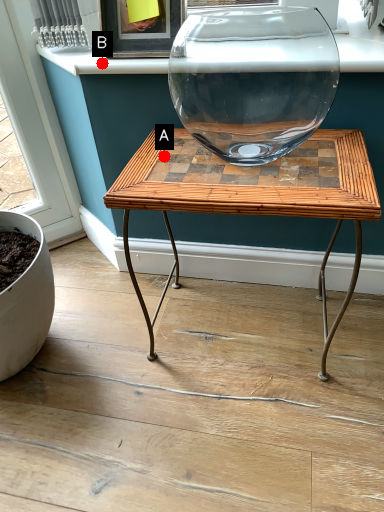
Question: Two points are circled on the image, labeled by A and B beside each circle. Which point appears farthest from the camera in this image?

Choices:
 (A) A is further
 (B) B is further

Answer: (B)